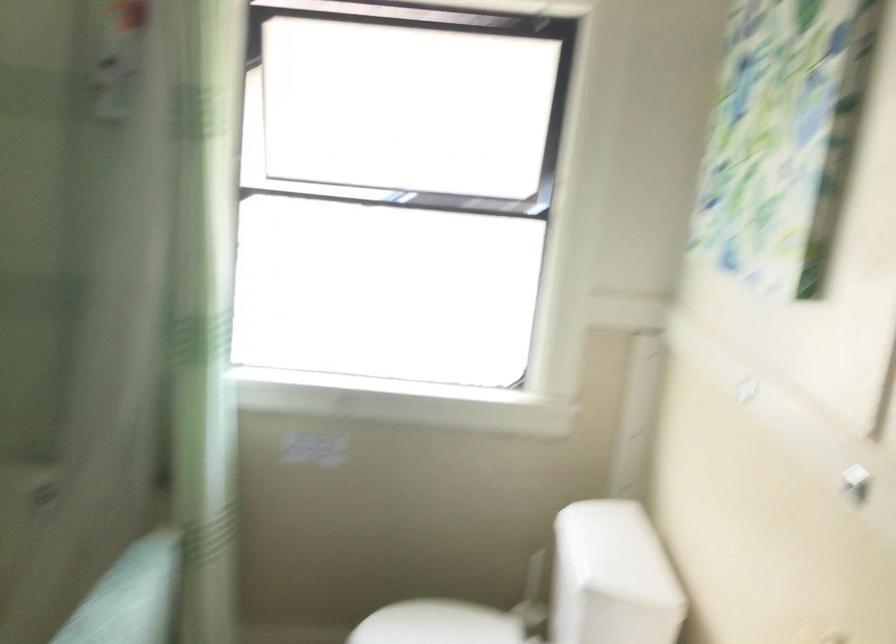
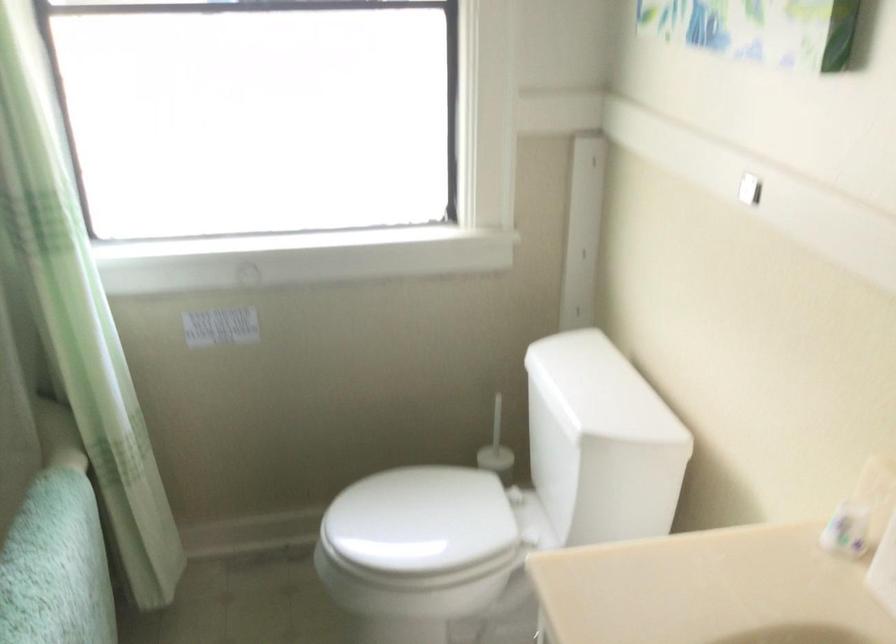
In a continuous first-person perspective shot, in which direction is the camera moving?

The cameraman walked toward left, forward.